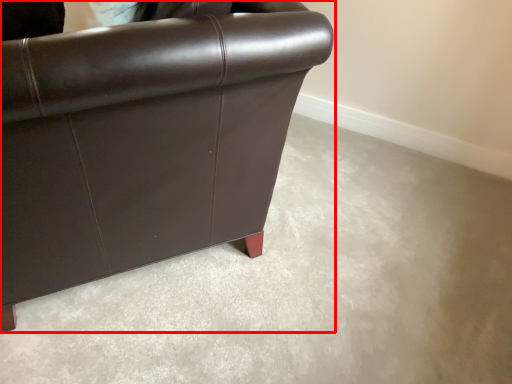
Question: Considering the relative positions of chair (annotated by the red box) and concrete in the image provided, where is chair (annotated by the red box) located with respect to the staircase?

Choices:
 (A) right
 (B) left

Answer: (B)